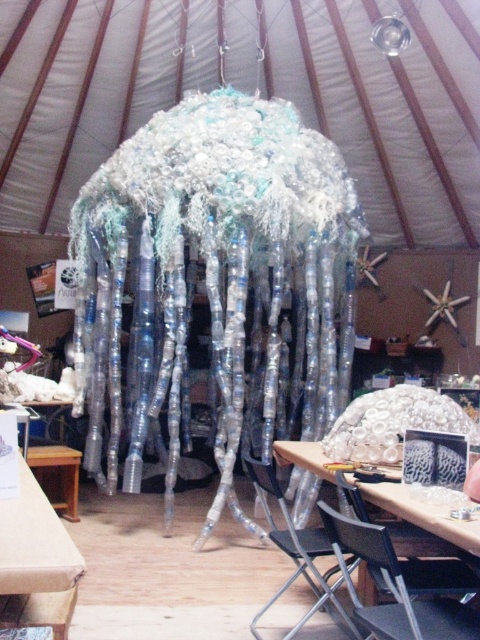
Question: From the image, what is the correct spatial relationship of black plastic chair at lower center in relation to metallic silver chair at lower center?

Choices:
 (A) below
 (B) above

Answer: (B)

Question: Which of the following is the farthest from the observer?

Choices:
 (A) wooden table at lower left
 (B) metallic silver chair at lower center

Answer: (A)

Question: Which of the following is the closest to the observer?

Choices:
 (A) (68, 516)
 (B) (288, 531)

Answer: (B)

Question: Does metallic silver chair at lower center appear under wooden table at lower left?

Choices:
 (A) yes
 (B) no

Answer: (B)

Question: Which of these objects is positioned farthest from the metallic silver chair at lower center?

Choices:
 (A) wooden table at lower left
 (B) black plastic chair at lower center

Answer: (A)

Question: Can you confirm if black plastic chair at lower center is positioned below wooden table at lower left?

Choices:
 (A) no
 (B) yes

Answer: (A)